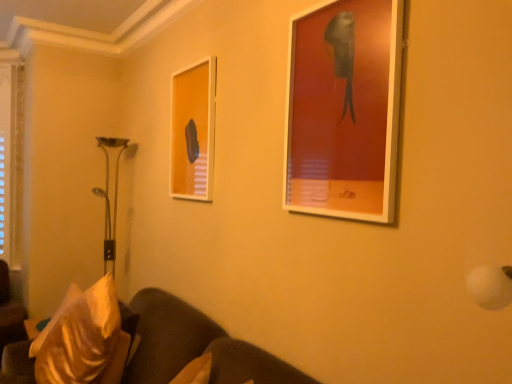
In order to click on metallic gold table lamp at left in this screenshot , I will do `click(109, 199)`.

Measure the distance between suede-like brown couch at lower left and camera.

Result: suede-like brown couch at lower left is 1.55 meters away from camera.

In order to click on matte glass picture frame at center, marked as the 1th picture frame in a left-to-right arrangement in this screenshot , I will do tap(193, 131).

At what (x,y) coordinates should I click in order to perform the action: click on metallic gold table lamp at left. Please return your answer as a coordinate pair (x, y). Looking at the image, I should click on (109, 199).

Is suede-like brown couch at lower left facing towards matte white picture frame at upper right, placed as the second picture frame when sorted from left to right?

No.

Are suede-like brown couch at lower left and matte white picture frame at upper right, the 2th picture frame in the back-to-front sequence, making contact?

There is a gap between suede-like brown couch at lower left and matte white picture frame at upper right, the 2th picture frame in the back-to-front sequence.

Based on their sizes in the image, would you say suede-like brown couch at lower left is bigger or smaller than matte white picture frame at upper right, marked as the first picture frame in a front-to-back arrangement?

Clearly, suede-like brown couch at lower left is larger in size than matte white picture frame at upper right, marked as the first picture frame in a front-to-back arrangement.

Is matte glass picture frame at center, the second picture frame in the right-to-left sequence, wider or thinner than velvet gold pillow at lower left?

Clearly, matte glass picture frame at center, the second picture frame in the right-to-left sequence, has less width compared to velvet gold pillow at lower left.

Can you see matte glass picture frame at center, which is counted as the second picture frame, starting from the front, touching velvet gold pillow at lower left?

No, matte glass picture frame at center, which is counted as the second picture frame, starting from the front, is not next to velvet gold pillow at lower left.

Considering the positions of objects matte white picture frame at upper right, the 2th picture frame in the back-to-front sequence, and velvet gold pillow at lower left in the image provided, who is more to the right, matte white picture frame at upper right, the 2th picture frame in the back-to-front sequence, or velvet gold pillow at lower left?

matte white picture frame at upper right, the 2th picture frame in the back-to-front sequence.

From a real-world perspective, is matte white picture frame at upper right, placed as the second picture frame when sorted from left to right, below velvet gold pillow at lower left?

No, from a real-world perspective, matte white picture frame at upper right, placed as the second picture frame when sorted from left to right, is not beneath velvet gold pillow at lower left.

Is matte white picture frame at upper right, arranged as the first picture frame when viewed from the right, positioned behind velvet gold pillow at lower left?

No, it is in front of velvet gold pillow at lower left.

Is matte white picture frame at upper right, placed as the second picture frame when sorted from left to right, placed right next to velvet gold pillow at lower left?

No, matte white picture frame at upper right, placed as the second picture frame when sorted from left to right, is not making contact with velvet gold pillow at lower left.

Can you tell me how much matte glass picture frame at center, the second picture frame in the right-to-left sequence, and metallic gold table lamp at left differ in facing direction?

0.0247 degrees separate the facing orientations of matte glass picture frame at center, the second picture frame in the right-to-left sequence, and metallic gold table lamp at left.

Considering the relative positions of matte glass picture frame at center, which is counted as the second picture frame, starting from the front, and metallic gold table lamp at left in the image provided, is matte glass picture frame at center, which is counted as the second picture frame, starting from the front, to the left of metallic gold table lamp at left from the viewer's perspective?

In fact, matte glass picture frame at center, which is counted as the second picture frame, starting from the front, is to the right of metallic gold table lamp at left.

Is matte glass picture frame at center, the second picture frame in the right-to-left sequence, further to camera compared to metallic gold table lamp at left?

That is False.

In the scene shown: From a real-world perspective, is matte glass picture frame at center, marked as the 1th picture frame in a left-to-right arrangement, positioned above or below metallic gold table lamp at left?

From a real-world perspective, matte glass picture frame at center, marked as the 1th picture frame in a left-to-right arrangement, is physically above metallic gold table lamp at left.

Is matte glass picture frame at center, which is counted as the second picture frame, starting from the front, positioned beyond the bounds of suede-like brown couch at lower left?

Absolutely, matte glass picture frame at center, which is counted as the second picture frame, starting from the front, is external to suede-like brown couch at lower left.

Which is in front, matte glass picture frame at center, the second picture frame in the right-to-left sequence, or suede-like brown couch at lower left?

Positioned in front is suede-like brown couch at lower left.

The width and height of the screenshot is (512, 384). Identify the location of studio couch beneath the matte glass picture frame at center, marked as the 1th picture frame in a left-to-right arrangement (from a real-world perspective). (196, 346).

Is point (184, 154) in front of point (152, 380)?

No, (184, 154) is further to viewer.

Is metallic gold table lamp at left smaller than matte glass picture frame at center, which is the 1th picture frame from back to front?

No, metallic gold table lamp at left is not smaller than matte glass picture frame at center, which is the 1th picture frame from back to front.

From a real-world perspective, is metallic gold table lamp at left physically located above or below matte glass picture frame at center, which is the 1th picture frame from back to front?

In terms of real-world spatial position, metallic gold table lamp at left is below matte glass picture frame at center, which is the 1th picture frame from back to front.

Which is in front, point (106, 254) or point (198, 150)?

The point (198, 150) is in front.

Image resolution: width=512 pixels, height=384 pixels. What are the coordinates of `table lamp below the matte glass picture frame at center, the second picture frame in the right-to-left sequence (from a real-world perspective)` in the screenshot? It's located at (109, 199).

Based on their positions, is velvet gold pillow at lower left located to the left or right of suede-like brown couch at lower left?

In the image, velvet gold pillow at lower left appears on the left side of suede-like brown couch at lower left.

From a real-world perspective, is velvet gold pillow at lower left physically below suede-like brown couch at lower left?

No, from a real-world perspective, velvet gold pillow at lower left is not below suede-like brown couch at lower left.

Is velvet gold pillow at lower left situated inside suede-like brown couch at lower left or outside?

velvet gold pillow at lower left is located inside suede-like brown couch at lower left.

Between velvet gold pillow at lower left and suede-like brown couch at lower left, which one has larger width?

With larger width is suede-like brown couch at lower left.

This screenshot has height=384, width=512. In order to click on studio couch to the left of matte white picture frame at upper right, the 2th picture frame in the back-to-front sequence in this screenshot , I will do `click(196, 346)`.

Identify the location of the 2nd picture frame above the velvet gold pillow at lower left (from the image's perspective). The height and width of the screenshot is (384, 512). (193, 131).

Which object lies nearer to the anchor point velvet gold pillow at lower left, matte glass picture frame at center, which is counted as the second picture frame, starting from the front, or metallic gold table lamp at left?

matte glass picture frame at center, which is counted as the second picture frame, starting from the front, lies closer to velvet gold pillow at lower left than the other object.

In the scene shown: Looking at the image, which one is located closer to matte glass picture frame at center, which is the 1th picture frame from back to front, matte white picture frame at upper right, arranged as the first picture frame when viewed from the right, or suede-like brown couch at lower left?

The object closer to matte glass picture frame at center, which is the 1th picture frame from back to front, is suede-like brown couch at lower left.

Which object lies nearer to the anchor point matte white picture frame at upper right, arranged as the first picture frame when viewed from the right, suede-like brown couch at lower left or metallic gold table lamp at left?

suede-like brown couch at lower left lies closer to matte white picture frame at upper right, arranged as the first picture frame when viewed from the right, than the other object.

From the image, which object appears to be nearer to metallic gold table lamp at left, suede-like brown couch at lower left or matte white picture frame at upper right, marked as the first picture frame in a front-to-back arrangement?

suede-like brown couch at lower left lies closer to metallic gold table lamp at left than the other object.

Looking at the image, which one is located further to suede-like brown couch at lower left, metallic gold table lamp at left or velvet gold pillow at lower left?

metallic gold table lamp at left is positioned further to the anchor suede-like brown couch at lower left.

Estimate the real-world distances between objects in this image. Which object is closer to metallic gold table lamp at left, suede-like brown couch at lower left or matte glass picture frame at center, which is the 1th picture frame from back to front?

matte glass picture frame at center, which is the 1th picture frame from back to front, lies closer to metallic gold table lamp at left than the other object.

Estimate the real-world distances between objects in this image. Which object is further from matte glass picture frame at center, which is the 1th picture frame from back to front, suede-like brown couch at lower left or matte white picture frame at upper right, marked as the first picture frame in a front-to-back arrangement?

Based on the image, matte white picture frame at upper right, marked as the first picture frame in a front-to-back arrangement, appears to be further to matte glass picture frame at center, which is the 1th picture frame from back to front.

When comparing their distances from matte glass picture frame at center, marked as the 1th picture frame in a left-to-right arrangement, does suede-like brown couch at lower left or metallic gold table lamp at left seem closer?

suede-like brown couch at lower left is positioned closer to the anchor matte glass picture frame at center, marked as the 1th picture frame in a left-to-right arrangement.

Locate an element on the screen. picture frame between matte glass picture frame at center, which is the 1th picture frame from back to front, and velvet gold pillow at lower left, in the vertical direction is located at coordinates (344, 110).

This screenshot has height=384, width=512. I want to click on pillow that lies between matte white picture frame at upper right, placed as the second picture frame when sorted from left to right, and suede-like brown couch at lower left from top to bottom, so click(x=83, y=339).

The height and width of the screenshot is (384, 512). Identify the location of picture frame between matte glass picture frame at center, marked as the 1th picture frame in a left-to-right arrangement, and suede-like brown couch at lower left from top to bottom. (344, 110).

The image size is (512, 384). Find the location of `picture frame between velvet gold pillow at lower left and metallic gold table lamp at left from front to back`. picture frame between velvet gold pillow at lower left and metallic gold table lamp at left from front to back is located at coordinates (193, 131).